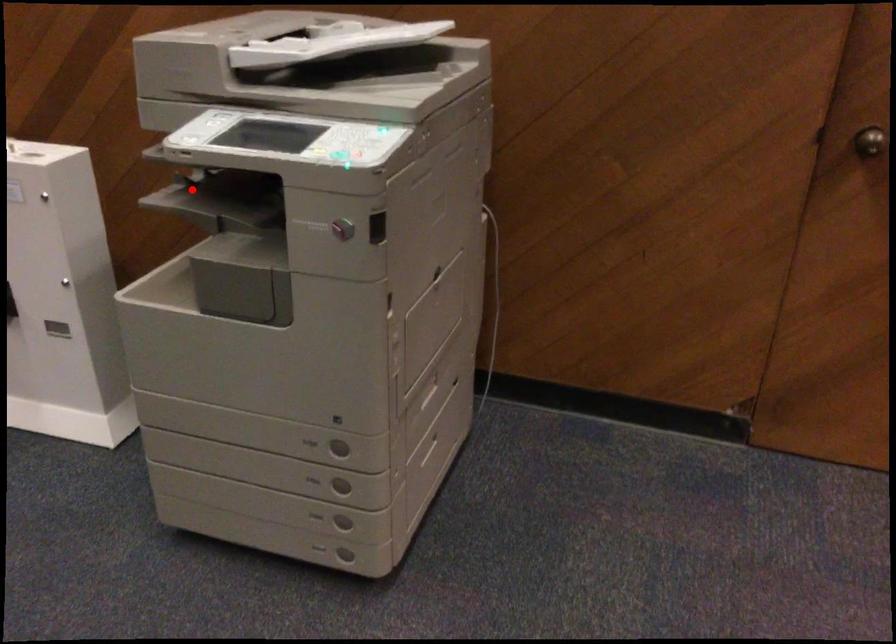
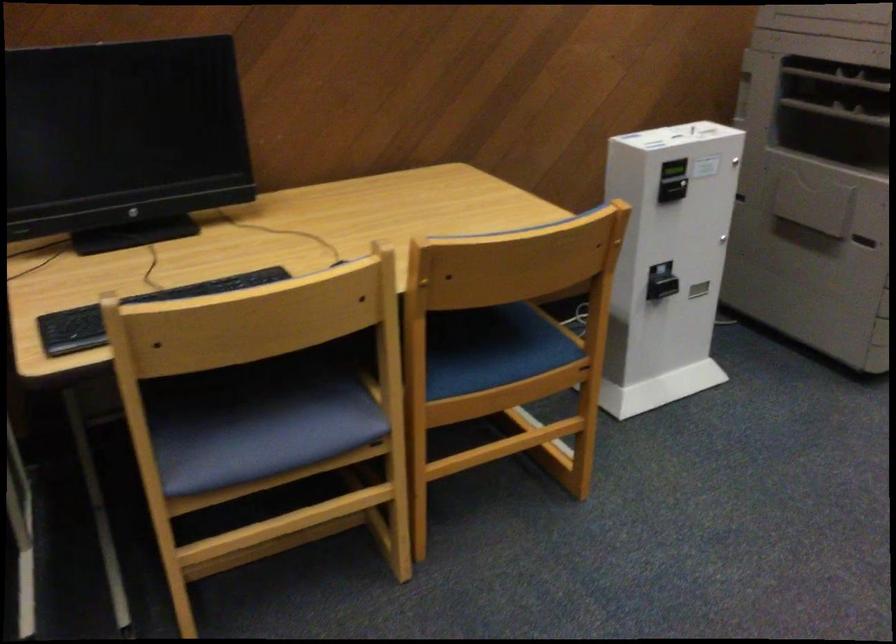
Locate, in the second image, the point that corresponds to the highlighted location in the first image.

(836, 111)